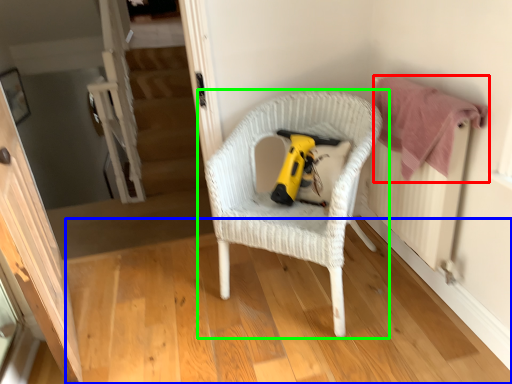
Question: Based on their relative distances, which object is nearer to clothe (highlighted by a red box)? Choose from wood (highlighted by a blue box) and chair (highlighted by a green box).

Choices:
 (A) wood
 (B) chair

Answer: (B)